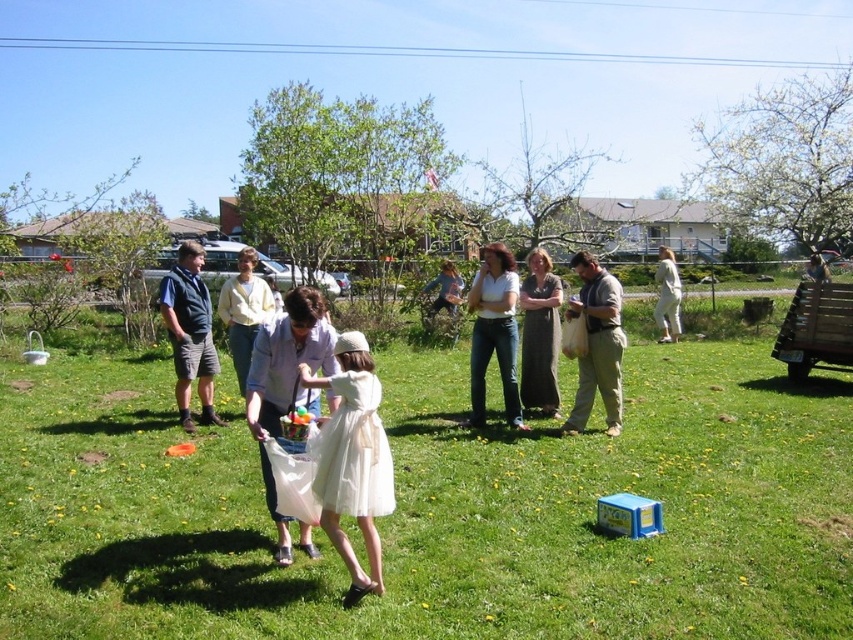
Question: Is white matte plastic bag at center thinner than dark blue vest at center?

Choices:
 (A) no
 (B) yes

Answer: (B)

Question: Observing the image, what is the correct spatial positioning of white plastic bag at center in reference to white tulle dress at center?

Choices:
 (A) above
 (B) below

Answer: (B)

Question: Which point is closer to the camera?

Choices:
 (A) (386, 515)
 (B) (270, 289)
 (C) (612, 417)
 (D) (254, 372)

Answer: (A)

Question: Observing the image, what is the correct spatial positioning of white satin dress at center in reference to matte khaki pants at center?

Choices:
 (A) above
 (B) below

Answer: (B)

Question: Which of these objects is positioned closest to the dark blue vest at center?

Choices:
 (A) white plastic bag at center
 (B) matte gray dress at center
 (C) denim jeans at center
 (D) light yellow sweater at center

Answer: (D)

Question: Which point is closer to the camera?

Choices:
 (A) (534, 284)
 (B) (605, 314)
 (C) (500, 365)
 (D) (204, 444)

Answer: (D)